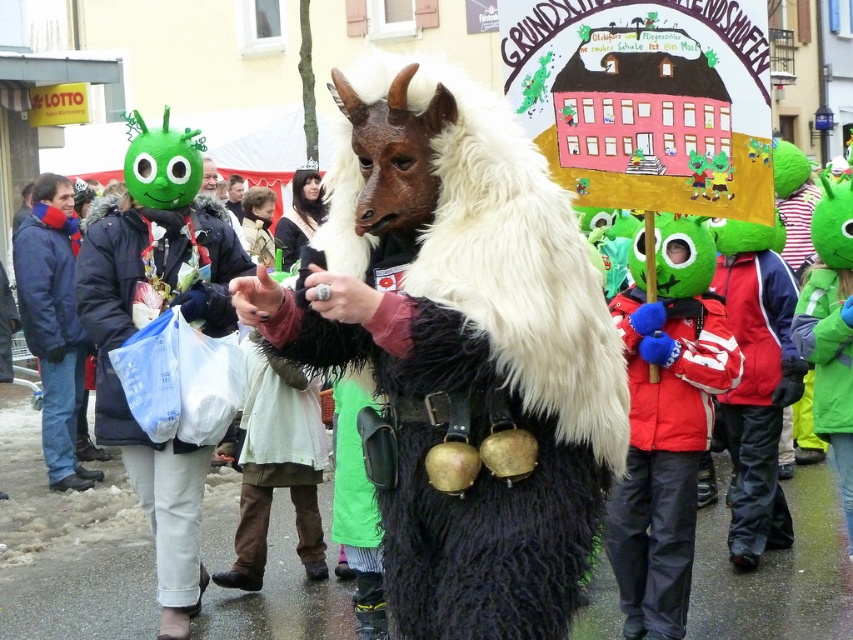
Question: Does furry black and white goat at center appear on the right side of matte green mask at center?

Choices:
 (A) no
 (B) yes

Answer: (A)

Question: Can you confirm if furry black and white goat at center is positioned above blue fleece jacket at left?

Choices:
 (A) yes
 (B) no

Answer: (A)

Question: Among these points, which one is nearest to the camera?

Choices:
 (A) (74, 396)
 (B) (476, 316)
 (C) (727, 404)
 (D) (173, 508)

Answer: (B)

Question: Observing the image, what is the correct spatial positioning of matte green mask at center in reference to blue fleece jacket at left?

Choices:
 (A) right
 (B) left

Answer: (A)

Question: Which of these objects is positioned closest to the green fabric bag at lower left?

Choices:
 (A) furry black and white goat at center
 (B) matte green mask at center

Answer: (A)

Question: Which point is closer to the camera?

Choices:
 (A) (234, 205)
 (B) (56, 294)
 (C) (733, 452)

Answer: (C)